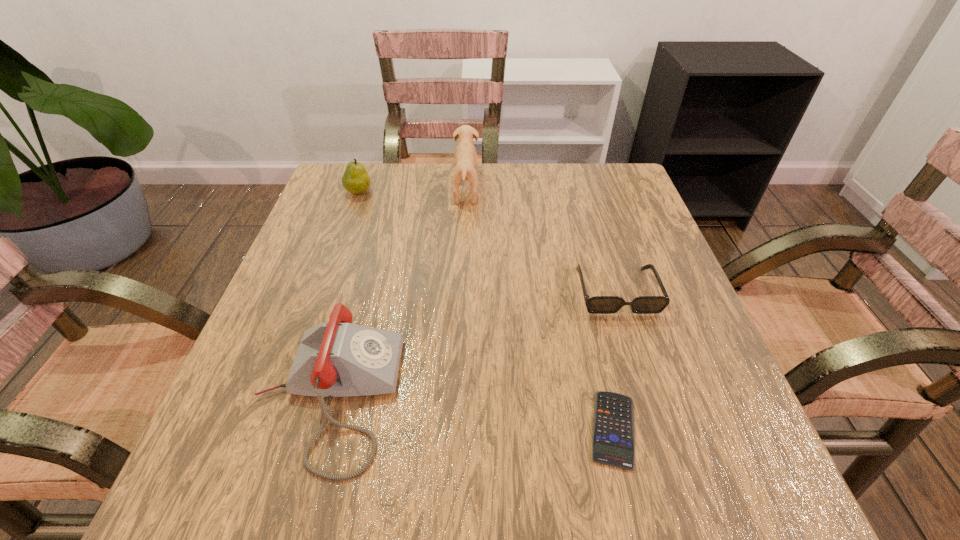
You are a GUI agent. You are given a task and a screenshot of the screen. Output one action in this format:
    pyautogui.click(x=<x>, y=<y>)
    Task: Click on the vacant area that lies between the pear and the shortest object
    This screenshot has width=960, height=540.
    Given the screenshot: What is the action you would take?
    point(486,310)

The image size is (960, 540). I want to click on free area in between the tallest object and the shortest object, so click(540, 309).

The height and width of the screenshot is (540, 960). I want to click on empty space between the telephone and the puppy, so (396, 293).

This screenshot has width=960, height=540. In order to click on unoccupied area between the tallest object and the telephone in this screenshot , I will do `click(396, 293)`.

Find the location of a particular element. Image resolution: width=960 pixels, height=540 pixels. empty location between the pear and the telephone is located at coordinates (343, 294).

This screenshot has height=540, width=960. I want to click on free space between the telephone and the pear, so click(343, 294).

The image size is (960, 540). Identify the location of free space that is in between the sunglasses and the telephone. [x=471, y=343].

Locate an element on the screen. The height and width of the screenshot is (540, 960). unoccupied area between the shortest object and the telephone is located at coordinates (470, 413).

This screenshot has height=540, width=960. I want to click on object that stands as the third closest to the telephone, so click(465, 154).

The height and width of the screenshot is (540, 960). I want to click on object that is the nearest to the calculator, so click(598, 304).